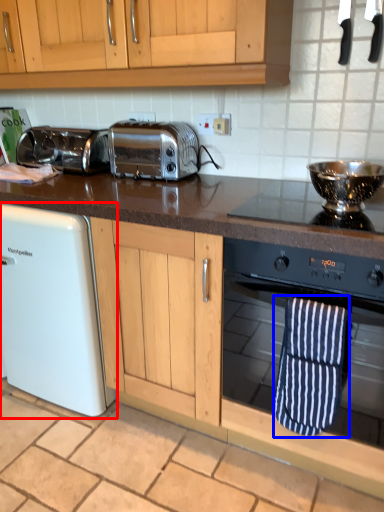
Question: Among these objects, which one is nearest to the camera, home appliance (highlighted by a red box) or beach towel (highlighted by a blue box)?

Choices:
 (A) home appliance
 (B) beach towel

Answer: (B)